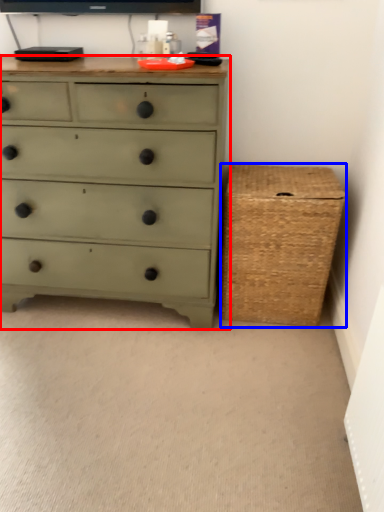
Question: Among these objects, which one is nearest to the camera, chest of drawers (highlighted by a red box) or basket (highlighted by a blue box)?

Choices:
 (A) chest of drawers
 (B) basket

Answer: (A)